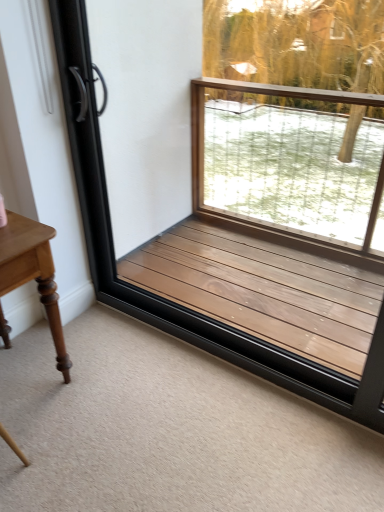
The width and height of the screenshot is (384, 512). What do you see at coordinates (176, 304) in the screenshot?
I see `brown wood window frame at center` at bounding box center [176, 304].

The image size is (384, 512). What are the coordinates of `brown wood window frame at center` in the screenshot? It's located at (176, 304).

This screenshot has width=384, height=512. In order to click on light brown wood table at left in this screenshot , I will do `click(33, 273)`.

What do you see at coordinates (33, 273) in the screenshot?
I see `light brown wood table at left` at bounding box center [33, 273].

Locate an element on the screen. The image size is (384, 512). brown wood window frame at center is located at coordinates (176, 304).

Which object is positioned more to the right, brown wood window frame at center or light brown wood table at left?

brown wood window frame at center.

Considering the relative positions of brown wood window frame at center and light brown wood table at left in the image provided, is brown wood window frame at center in front of light brown wood table at left?

Yes, it is.

Between point (209, 340) and point (64, 352), which one is positioned behind?

The point (209, 340) is behind.

From the image's perspective, is brown wood window frame at center on light brown wood table at left?

Yes, from the image's perspective, brown wood window frame at center is over light brown wood table at left.

From a real-world perspective, is brown wood window frame at center under light brown wood table at left?

No, from a real-world perspective, brown wood window frame at center is not under light brown wood table at left.

Can you confirm if brown wood window frame at center is thinner than light brown wood table at left?

Correct, the width of brown wood window frame at center is less than that of light brown wood table at left.

Who is taller, brown wood window frame at center or light brown wood table at left?

With more height is brown wood window frame at center.

Considering the sizes of brown wood window frame at center and light brown wood table at left in the image, is brown wood window frame at center bigger or smaller than light brown wood table at left?

brown wood window frame at center is bigger than light brown wood table at left.

Would you say brown wood window frame at center contains light brown wood table at left?

No, brown wood window frame at center does not contain light brown wood table at left.

Would you consider brown wood window frame at center to be distant from light brown wood table at left?

No, there isn't a large distance between brown wood window frame at center and light brown wood table at left.

Is light brown wood table at left at the back of brown wood window frame at center?

That's not correct — brown wood window frame at center is not looking away from light brown wood table at left.

What's the angular difference between brown wood window frame at center and light brown wood table at left's facing directions?

The angle between the facing direction of brown wood window frame at center and the facing direction of light brown wood table at left is 89.7 degrees.

You are a GUI agent. You are given a task and a screenshot of the screen. Output one action in this format:
    pyautogui.click(x=<x>, y=<y>)
    Task: Click on the window frame on the right of light brown wood table at left
    This screenshot has width=384, height=512.
    Given the screenshot: What is the action you would take?
    pyautogui.click(x=176, y=304)

Considering the relative positions of light brown wood table at left and brown wood window frame at center in the image provided, is light brown wood table at left to the left of brown wood window frame at center from the viewer's perspective?

Yes.

Is light brown wood table at left further to camera compared to brown wood window frame at center?

Yes.

Is point (56, 329) positioned before point (375, 365)?

That is False.

From the image's perspective, is light brown wood table at left above or below brown wood window frame at center?

Based on their image positions, light brown wood table at left is located beneath brown wood window frame at center.

From a real-world perspective, is light brown wood table at left above or below brown wood window frame at center?

light brown wood table at left is situated lower than brown wood window frame at center in the real world.

Considering the relative sizes of light brown wood table at left and brown wood window frame at center in the image provided, is light brown wood table at left thinner than brown wood window frame at center?

No, light brown wood table at left is not thinner than brown wood window frame at center.

Is light brown wood table at left taller or shorter than brown wood window frame at center?

Considering their sizes, light brown wood table at left has less height than brown wood window frame at center.

Considering the sizes of objects light brown wood table at left and brown wood window frame at center in the image provided, who is smaller, light brown wood table at left or brown wood window frame at center?

Smaller between the two is light brown wood table at left.

Based on the photo, is brown wood window frame at center located within light brown wood table at left?

No, light brown wood table at left does not contain brown wood window frame at center.

Are light brown wood table at left and brown wood window frame at center far apart?

light brown wood table at left is actually quite close to brown wood window frame at center.

Is light brown wood table at left oriented away from brown wood window frame at center?

No, brown wood window frame at center is not at the back of light brown wood table at left.

The image size is (384, 512). Find the location of `table that is behind the brown wood window frame at center`. table that is behind the brown wood window frame at center is located at coordinates (33, 273).

Locate an element on the screen. This screenshot has height=512, width=384. window frame positioned vertically above the light brown wood table at left (from a real-world perspective) is located at coordinates (176, 304).

This screenshot has width=384, height=512. In order to click on table behind the brown wood window frame at center in this screenshot , I will do `click(33, 273)`.